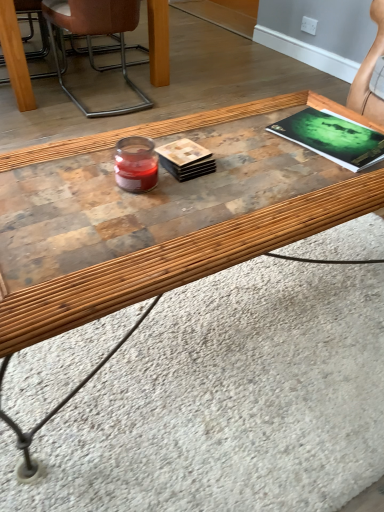
Question: Considering the positions of brown leather chair at upper left and green matte magazine at upper right in the image, is brown leather chair at upper left wider or thinner than green matte magazine at upper right?

Choices:
 (A) wide
 (B) thin

Answer: (A)

Question: From a real-world perspective, is brown leather chair at upper left physically located above or below green matte magazine at upper right?

Choices:
 (A) below
 (B) above

Answer: (A)

Question: From their relative heights in the image, would you say brown leather chair at upper left is taller or shorter than green matte magazine at upper right?

Choices:
 (A) short
 (B) tall

Answer: (B)

Question: Considering the positions of green matte magazine at upper right and brown leather chair at upper left in the image, is green matte magazine at upper right taller or shorter than brown leather chair at upper left?

Choices:
 (A) tall
 (B) short

Answer: (B)

Question: From a real-world perspective, relative to brown leather chair at upper left, is green matte magazine at upper right vertically above or below?

Choices:
 (A) above
 (B) below

Answer: (A)

Question: Considering the positions of point (332, 137) and point (119, 18), is point (332, 137) closer or farther from the camera than point (119, 18)?

Choices:
 (A) farther
 (B) closer

Answer: (B)

Question: Considering their positions, is green matte magazine at upper right located in front of or behind brown leather chair at upper left?

Choices:
 (A) front
 (B) behind

Answer: (A)